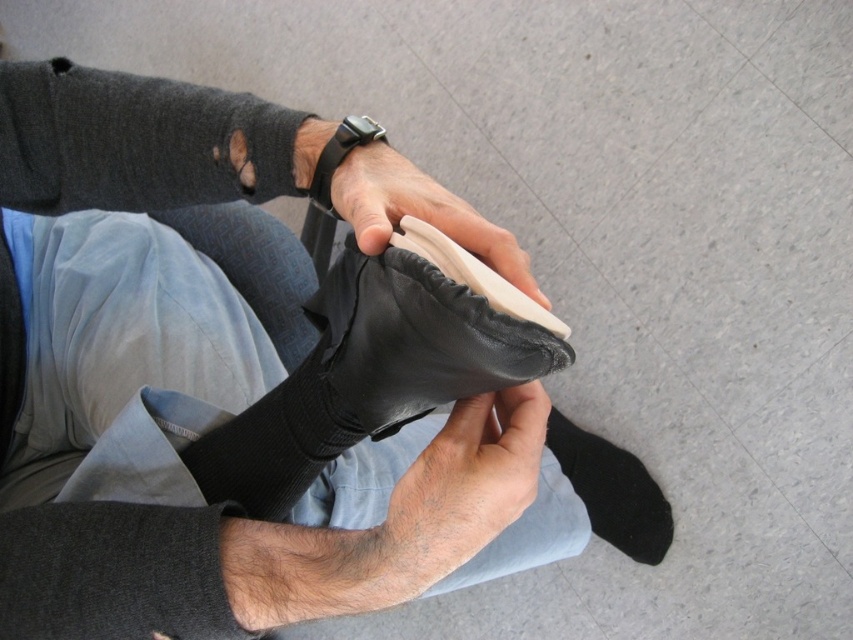
Question: Can you confirm if leather shoe at center is positioned below black suede sock at lower right?

Choices:
 (A) no
 (B) yes

Answer: (A)

Question: Which object appears closest to the camera in this image?

Choices:
 (A) leather shoe at center
 (B) black suede sock at lower right
 (C) smooth skin at center

Answer: (A)

Question: Which point appears farthest from the camera in this image?

Choices:
 (A) 476,269
 (B) 572,477
 (C) 465,224
 (D) 489,502

Answer: (B)

Question: Is black leather shoe at center positioned at the back of leather shoe at center?

Choices:
 (A) no
 (B) yes

Answer: (A)

Question: Does black leather shoe at center have a greater width compared to black suede sock at lower right?

Choices:
 (A) yes
 (B) no

Answer: (B)

Question: Which object is the farthest from the leather shoe at center?

Choices:
 (A) black suede sock at lower right
 (B) black leather shoe at center

Answer: (A)